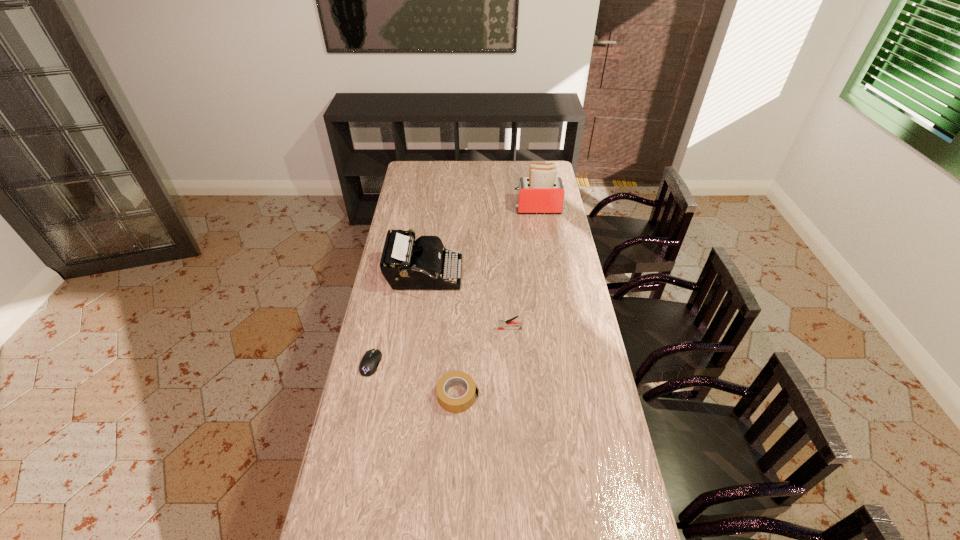
The height and width of the screenshot is (540, 960). Find the location of `free space located on the front-facing side of the tallest object`. free space located on the front-facing side of the tallest object is located at coordinates (474, 208).

Find the location of a particular element. vacant region located on the front-facing side of the tallest object is located at coordinates (453, 208).

Locate an element on the screen. The width and height of the screenshot is (960, 540). free space located on the front-facing side of the tallest object is located at coordinates (451, 208).

Where is `vacant area located on the typing side of the second farthest object`? vacant area located on the typing side of the second farthest object is located at coordinates (538, 275).

The width and height of the screenshot is (960, 540). Identify the location of vacant space located on the handle side of the stapler. (436, 329).

This screenshot has height=540, width=960. In order to click on vacant point located on the handle side of the stapler in this screenshot , I will do `click(472, 329)`.

Identify the location of free spot located 0.350m on the handle side of the stapler. (408, 329).

Locate an element on the screen. The width and height of the screenshot is (960, 540). vacant space located 0.130m at the edge of the duct tape is located at coordinates (516, 396).

Where is `free space located on the back of the second nearest object`? This screenshot has height=540, width=960. free space located on the back of the second nearest object is located at coordinates (383, 308).

The image size is (960, 540). In order to click on typewriter that is at the left edge in this screenshot , I will do `click(407, 264)`.